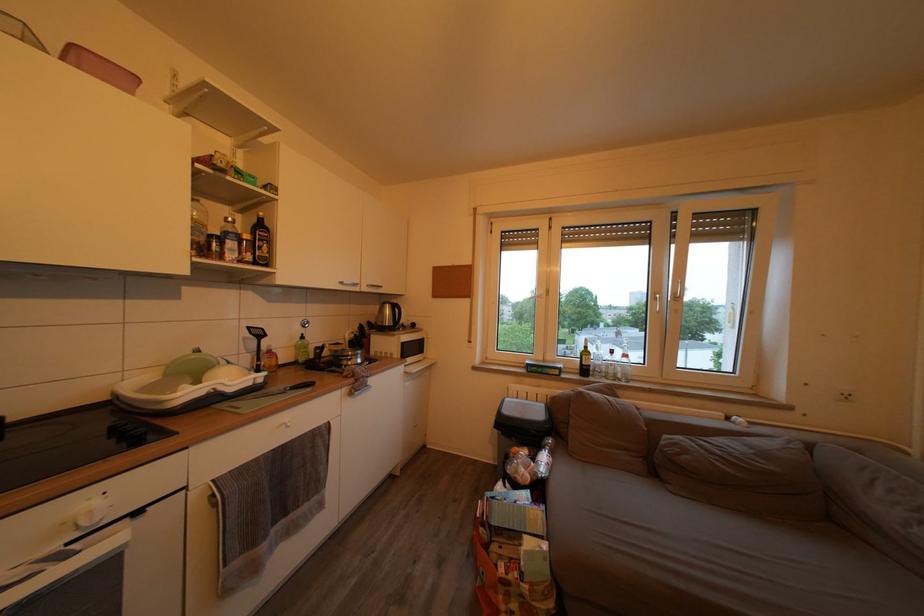
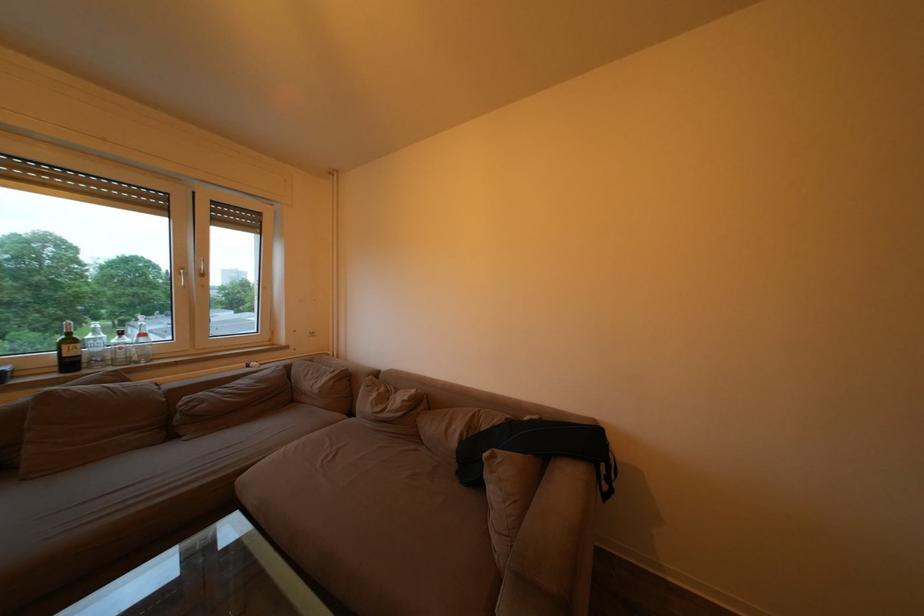
Find the pixel in the second image that matches (869,459) in the first image.

(319, 367)